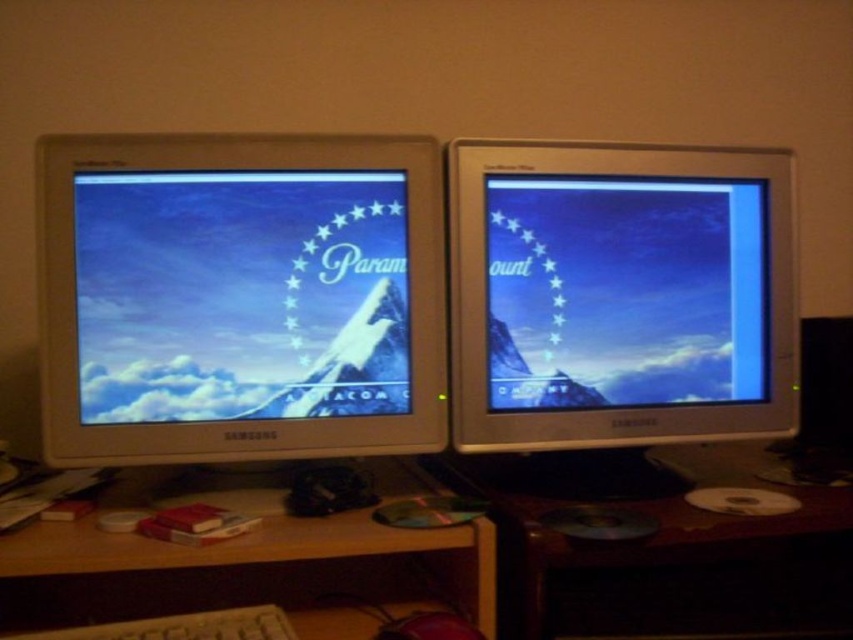
Question: Which object is the closest to the wooden at lower right?

Choices:
 (A) wooden at lower left
 (B) white glossy monitor at center
 (C) white plastic keyboard at lower center

Answer: (A)

Question: Does wooden at lower left appear on the left side of white plastic keyboard at lower center?

Choices:
 (A) no
 (B) yes

Answer: (A)

Question: Does wooden at lower left appear on the right side of white plastic keyboard at lower center?

Choices:
 (A) no
 (B) yes

Answer: (B)

Question: Considering the real-world distances, which object is closest to the white glossy monitor at center?

Choices:
 (A) matte silver monitor at right
 (B) white plastic keyboard at lower center
 (C) wooden at lower right
 (D) wooden at lower left

Answer: (A)

Question: Does white glossy monitor at center appear over white plastic keyboard at lower center?

Choices:
 (A) no
 (B) yes

Answer: (B)

Question: Which point is closer to the camera?

Choices:
 (A) (120, 285)
 (B) (113, 552)
 (C) (790, 422)

Answer: (B)